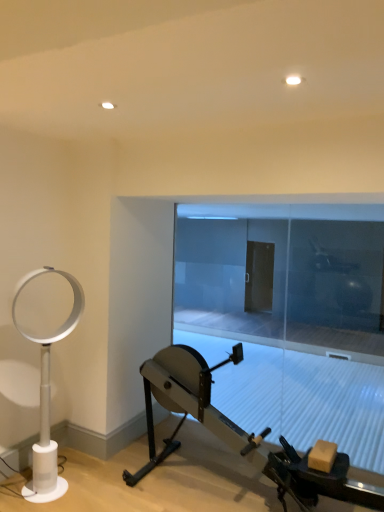
Question: Based on their sizes in the image, would you say white plastic fan at left is bigger or smaller than transparent glass door at center?

Choices:
 (A) big
 (B) small

Answer: (A)

Question: Visually, is white plastic fan at left positioned to the left or to the right of transparent glass door at center?

Choices:
 (A) left
 (B) right

Answer: (A)

Question: Estimate the real-world distances between objects in this image. Which object is farther from the white plastic fan at left?

Choices:
 (A) metallic silver stationary bicycle at center
 (B) transparent glass door at center

Answer: (B)

Question: Which is nearer to the metallic silver stationary bicycle at center?

Choices:
 (A) white plastic fan at left
 (B) transparent glass door at center

Answer: (A)